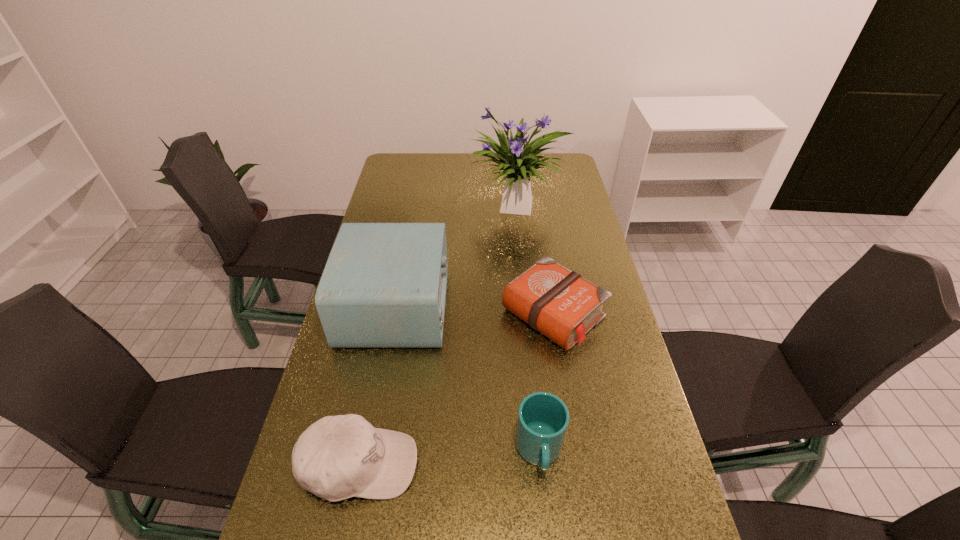
You are a GUI agent. You are given a task and a screenshot of the screen. Output one action in this format:
    pyautogui.click(x=<x>, y=<y>)
    Task: Click on the vacant space situated on the back of the Bible
    The width and height of the screenshot is (960, 540).
    Given the screenshot: What is the action you would take?
    pyautogui.click(x=539, y=225)

Find the location of `radio receiver that is at the left edge`. radio receiver that is at the left edge is located at coordinates (384, 285).

At what (x,y) coordinates should I click in order to perform the action: click on baseball cap located in the left edge section of the desktop. Please return your answer as a coordinate pair (x, y). The width and height of the screenshot is (960, 540). Looking at the image, I should click on (338, 457).

Identify the location of flower arrangement situated at the right edge. (517, 198).

Find the location of `Bible that is at the right edge`. Bible that is at the right edge is located at coordinates (559, 303).

In the image, there is a desktop. In order to click on vacant space at the far edge in this screenshot , I will do [x=488, y=173].

The width and height of the screenshot is (960, 540). In the image, there is a desktop. Identify the location of blank space at the left edge. (385, 190).

Identify the location of blank space at the right edge of the desktop. (611, 341).

Image resolution: width=960 pixels, height=540 pixels. I want to click on free space between the shortest object and the flower arrangement, so click(535, 261).

I want to click on blank region between the baseball cap and the cup, so click(x=449, y=458).